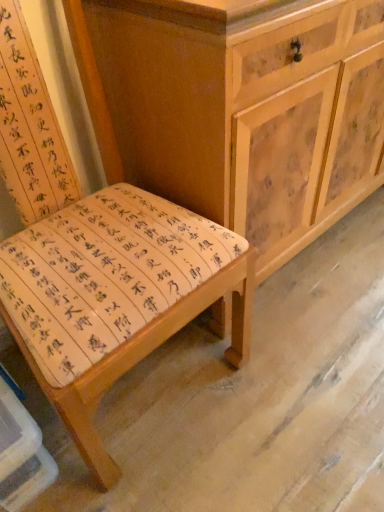
The height and width of the screenshot is (512, 384). Find the location of `free spot below wooden bench at center (from a real-world perspective)`. free spot below wooden bench at center (from a real-world perspective) is located at coordinates (160, 398).